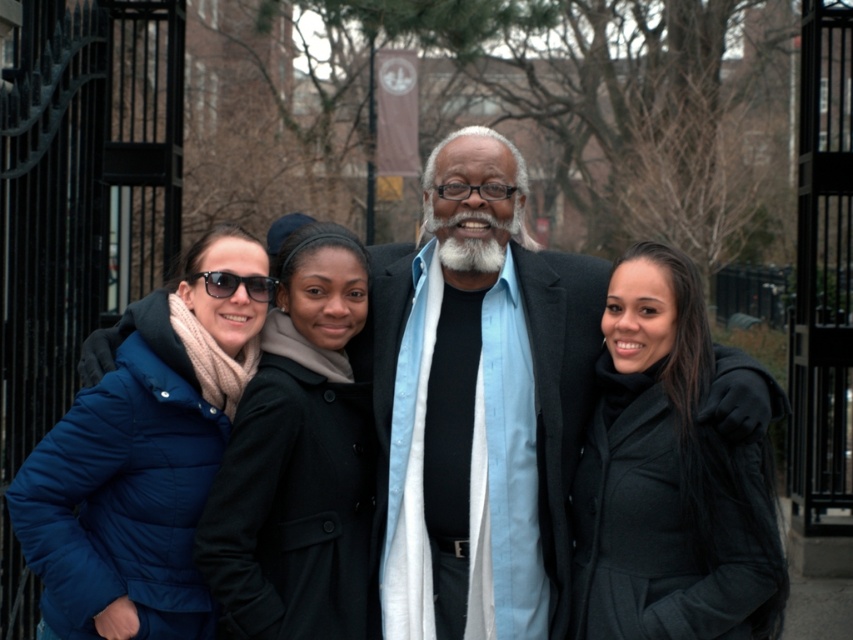
Question: Which is farther from the blue puffer jacket at left?

Choices:
 (A) transparent plastic glasses at center
 (B) light blue shirt at center
 (C) light blue fabric shirt at center

Answer: (A)

Question: Does black wool coat at center have a greater width compared to white matte beard at center?

Choices:
 (A) no
 (B) yes

Answer: (B)

Question: Is blue puffer jacket at left above white matte beard at center?

Choices:
 (A) yes
 (B) no

Answer: (B)

Question: Is blue puffer jacket at left below transparent plastic glasses at center?

Choices:
 (A) no
 (B) yes

Answer: (B)

Question: Based on their relative distances, which object is farther from the blue puffer jacket at left?

Choices:
 (A) white soft beard at center
 (B) white matte beard at center
 (C) transparent plastic glasses at center

Answer: (B)

Question: Which object is farther from the camera taking this photo?

Choices:
 (A) light blue fabric shirt at center
 (B) black wool coat at center
 (C) matte black sunglasses at left
 (D) matte black coat at center

Answer: (A)